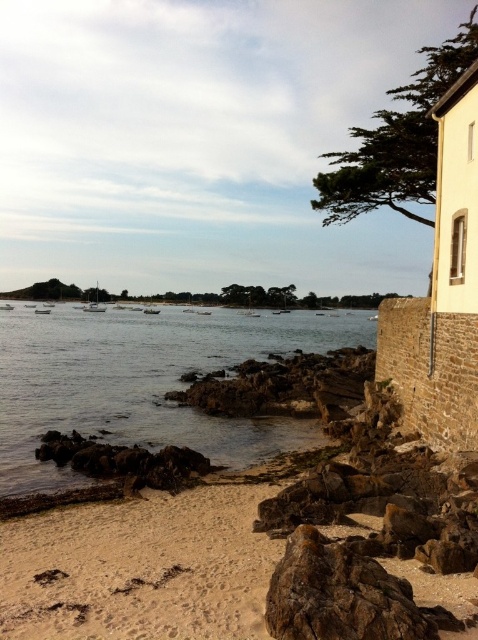
Is point (21, 432) positioned behind point (310, 413)?

No, (21, 432) is closer to viewer.

Does clear water at lower left have a smaller size compared to rusty metallic rocks at center?

No.

Which is in front, point (180, 426) or point (344, 403)?

Point (180, 426) is more forward.

Image resolution: width=478 pixels, height=640 pixels. What are the coordinates of `clear water at lower left` in the screenshot? It's located at (145, 381).